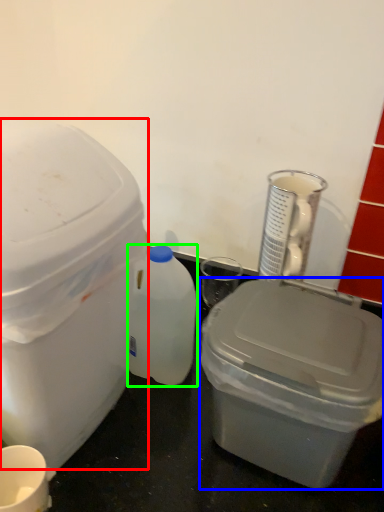
Question: Based on their relative distances, which object is nearer to storage box (highlighted by a red box)? Choose from storage box (highlighted by a blue box) and bottle (highlighted by a green box).

Choices:
 (A) storage box
 (B) bottle

Answer: (B)